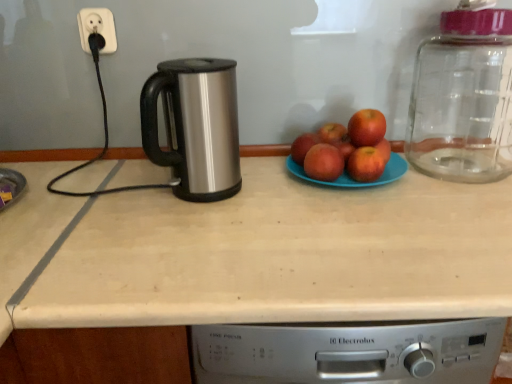
Locate an element on the screen. vacant area that is in front of transparent glass jar at right is located at coordinates (476, 200).